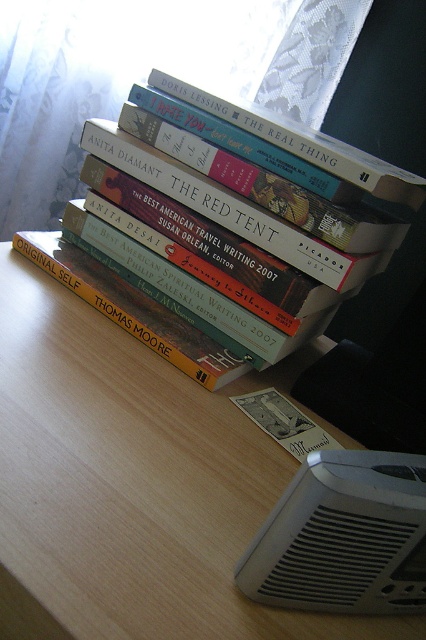
Looking at this image, you are a book collector standing 20 inches away from a desk with a stack of books. You see the hardcover book at center. Can you reach it without moving closer?

The hardcover book at center is 22.51 inches away from the viewer, so you cannot reach it without moving closer since you are currently 20 inches away.

You are organizing a bookshelf and need to place the yellow matte book at center onto the wooden table at center. The book is 4 inches thick. Will it fit on the table without overlapping the edge?

The wooden table at center is 4.31 inches from the yellow matte book at center. Since the book is only 4 inches thick, it will fit on the table without overlapping the edge as there is enough space between them.

You are organizing a bookshelf and need to place the hardcover book at center and the yellow matte book at center. Given their sizes, which one should you place first to ensure stability?

The hardcover book at center is larger in size than the yellow matte book at center, so you should place the hardcover book at center first to provide a stable base for the yellow matte book at center.